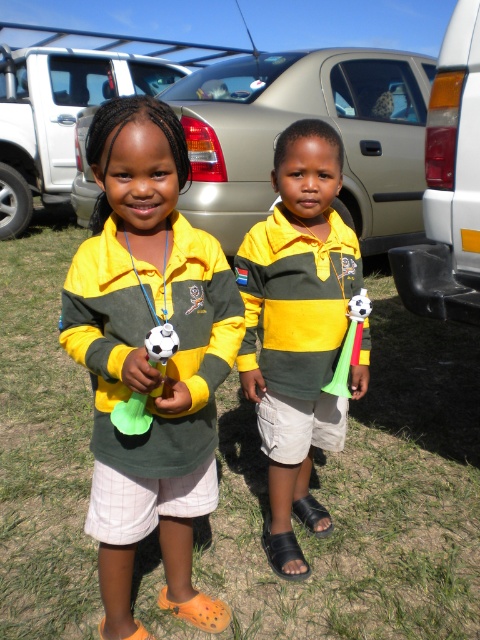
You are a photographer trying to capture the perfect shot of the green grass at lower center. Based on the coordinates provided, where should you position your camera to ensure the grass is centered in the frame?

The green grass at lower center is located at coordinates point (363, 499), so position the camera so that this point is at the center of the frame.

Based on the scene described, where is the green grass at lower center located in relation to the silver metallic car at center?

The green grass at lower center is located to the right of the silver metallic car at center.

You are a photographer trying to capture a photo of both children holding their soccer whistles. You notice two specific points marked in the image. The first point, labeled as point 1 at coordinates point (208,476), is located near the child on the left. The second point, labeled as point 2 at coordinates point (406,72), is closer to the child on the right. To ensure both children are in focus, you need to adjust your camera settings. Which point should you focus on to make sure both children are in

Point 1 at coordinates point (208,476) is in front of point 2 at coordinates point (406,72). Therefore, focusing on point 1 will ensure both children are in focus since it is closer to the camera.